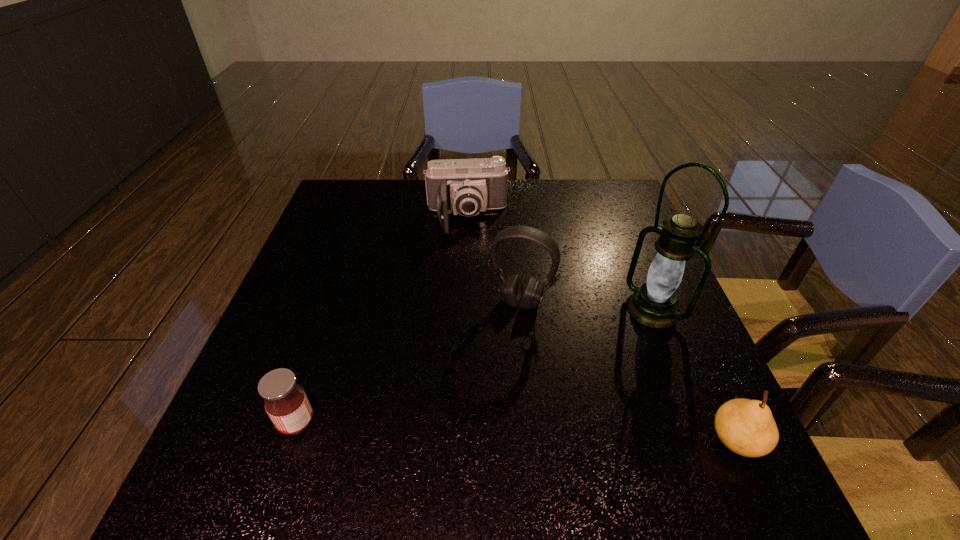
Locate an element on the screen. This screenshot has width=960, height=540. free space located 0.220m at the front of the camera with an open lens cover is located at coordinates (473, 292).

At what (x,y) coordinates should I click in order to perform the action: click on vacant point located 0.360m at the front of the camera with an open lens cover. Please return your answer as a coordinate pair (x, y). The height and width of the screenshot is (540, 960). Looking at the image, I should click on (476, 336).

You are a GUI agent. You are given a task and a screenshot of the screen. Output one action in this format:
    pyautogui.click(x=<x>, y=<y>)
    Task: Click on the vacant area situated 0.310m at the front of the camera with an open lens cover
    The height and width of the screenshot is (540, 960).
    Given the screenshot: What is the action you would take?
    pyautogui.click(x=475, y=320)

This screenshot has width=960, height=540. Find the location of `blank area located on the side where the lantern emits light`. blank area located on the side where the lantern emits light is located at coordinates (605, 350).

Find the location of a particular element. This screenshot has height=540, width=960. free space located 0.330m on the side where the lantern emits light is located at coordinates (537, 409).

In order to click on vacant region located 0.140m on the side where the lantern emits light in this screenshot , I will do `click(599, 355)`.

Where is `object at the far edge`? object at the far edge is located at coordinates pyautogui.click(x=461, y=186).

Image resolution: width=960 pixels, height=540 pixels. Find the location of `jam situated at the near edge`. jam situated at the near edge is located at coordinates (286, 403).

The width and height of the screenshot is (960, 540). I want to click on pear that is at the near edge, so click(x=747, y=427).

At what (x,y) coordinates should I click in order to perform the action: click on object positioned at the left edge. Please return your answer as a coordinate pair (x, y). The width and height of the screenshot is (960, 540). Looking at the image, I should click on (286, 403).